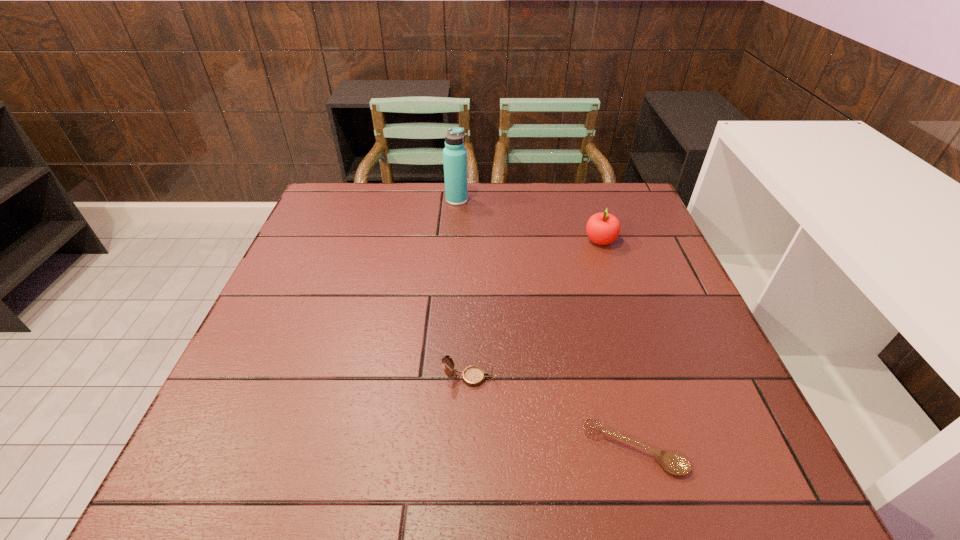
Where is `thermos bottle`? thermos bottle is located at coordinates (454, 154).

Locate an element on the screen. This screenshot has width=960, height=540. the tallest object is located at coordinates (454, 154).

At what (x,y) coordinates should I click in order to perform the action: click on the second farthest object. Please return your answer as a coordinate pair (x, y). The image size is (960, 540). Looking at the image, I should click on (603, 228).

The height and width of the screenshot is (540, 960). Find the location of `apple`. apple is located at coordinates pyautogui.click(x=603, y=228).

Image resolution: width=960 pixels, height=540 pixels. Find the location of `compass`. compass is located at coordinates (473, 376).

The image size is (960, 540). I want to click on the third tallest object, so click(473, 376).

You are a GUI agent. You are given a task and a screenshot of the screen. Output one action in this format:
    pyautogui.click(x=<x>, y=<y>)
    Task: Click on the ladle
    The height and width of the screenshot is (540, 960).
    Given the screenshot: What is the action you would take?
    pyautogui.click(x=673, y=462)

Locate an element on the screen. Image resolution: width=960 pixels, height=540 pixels. the nearest object is located at coordinates (673, 462).

Find the location of `free space located on the front of the farthest object`. free space located on the front of the farthest object is located at coordinates (450, 296).

You are a GUI agent. You are given a task and a screenshot of the screen. Output one action in this format:
    pyautogui.click(x=<x>, y=<y>)
    Task: Click on the vacant space located on the back of the third nearest object
    
    Given the screenshot: What is the action you would take?
    tap(583, 189)